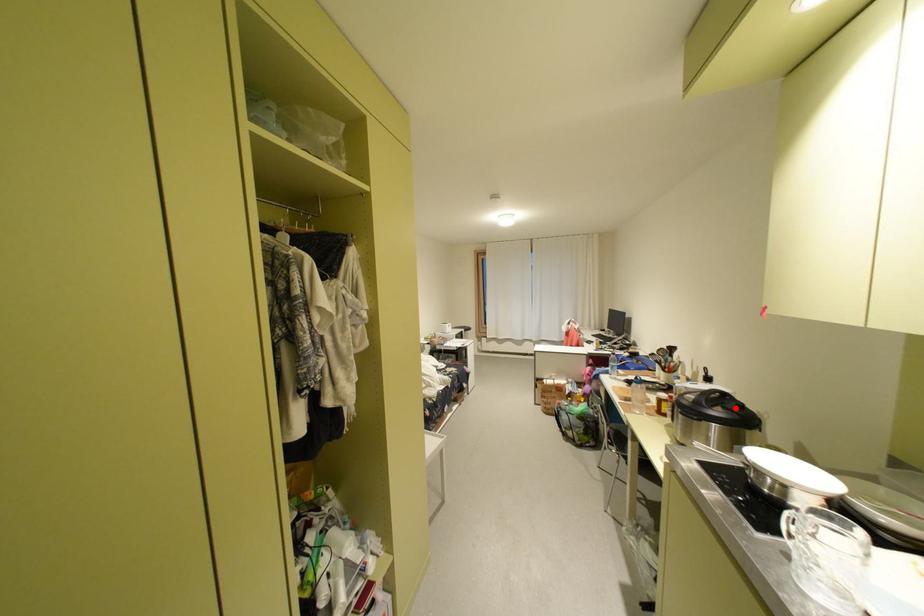
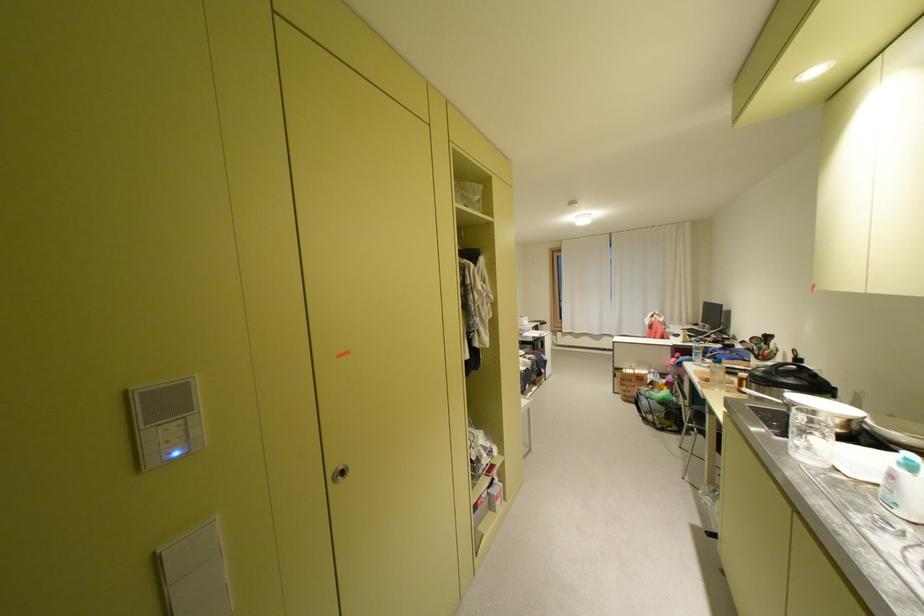
In the second image, find the point that corresponds to the highlighted location in the first image.

(808, 378)